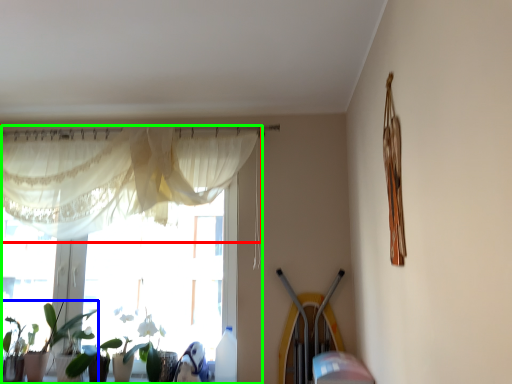
Question: Which object is the closest to the curtain (highlighted by a red box)? Choose among these: houseplant (highlighted by a blue box) or window (highlighted by a green box).

Choices:
 (A) houseplant
 (B) window

Answer: (B)